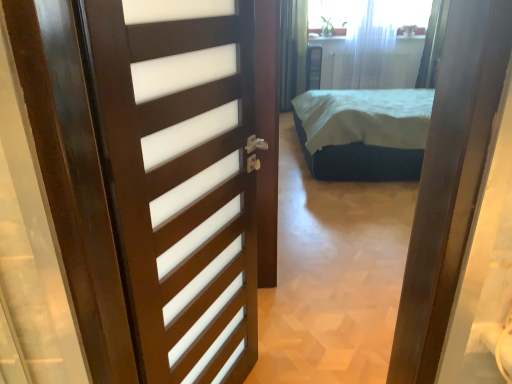
What do you see at coordinates (369, 48) in the screenshot? The width and height of the screenshot is (512, 384). I see `white sheer curtain at upper center` at bounding box center [369, 48].

Identify the location of dark wood door at left. This screenshot has height=384, width=512. (183, 176).

Is dark green fabric bed at center outside of dark wood door at left?

dark green fabric bed at center lies outside dark wood door at left's area.

Where is `bed located underneath the dark wood door at left (from a real-world perspective)`? bed located underneath the dark wood door at left (from a real-world perspective) is located at coordinates (364, 133).

Does dark green fabric bed at center come in front of dark wood door at left?

No, dark green fabric bed at center is further to the viewer.

Is dark green fabric bed at center touching dark wood door at left?

No, dark green fabric bed at center is not making contact with dark wood door at left.

From the image's perspective, between dark wood door at left and dark green fabric bed at center, which one is located above?

dark green fabric bed at center is shown above in the image.

How many degrees apart are the facing directions of dark wood door at left and dark green fabric bed at center?

153 degrees.

Based on the photo, is dark wood door at left in contact with dark green fabric bed at center?

No, dark wood door at left is not next to dark green fabric bed at center.

Looking at their sizes, would you say dark wood door at left is wider or thinner than dark green fabric bed at center?

Considering their sizes, dark wood door at left looks slimmer than dark green fabric bed at center.

The width and height of the screenshot is (512, 384). In order to click on curtain lying on the right of dark wood door at left in this screenshot , I will do `click(369, 48)`.

Consider the image. Is white sheer curtain at upper center located within dark wood door at left?

No, white sheer curtain at upper center is not a part of dark wood door at left.

From the picture: Which point is more distant from viewer, (112, 117) or (372, 49)?

The point (372, 49) is farther.

From the picture: Considering the sizes of objects dark wood door at left and white sheer curtain at upper center in the image provided, who is bigger, dark wood door at left or white sheer curtain at upper center?

white sheer curtain at upper center.

Which is closer to the camera, (352, 85) or (376, 160)?

Clearly, point (352, 85) is more distant from the camera than point (376, 160).

What's the angular difference between white sheer curtain at upper center and dark green fabric bed at center's facing directions?

white sheer curtain at upper center and dark green fabric bed at center are facing 89.7 degrees away from each other.

From the picture: Which of these two, white sheer curtain at upper center or dark green fabric bed at center, stands shorter?

dark green fabric bed at center is shorter.

From the image's perspective, which object appears higher, white sheer curtain at upper center or dark green fabric bed at center?

From the image's view, white sheer curtain at upper center is above.

Is white sheer curtain at upper center with dark wood door at left?

white sheer curtain at upper center and dark wood door at left are not in contact.

Is white sheer curtain at upper center looking in the opposite direction of dark wood door at left?

That's not correct — white sheer curtain at upper center is not looking away from dark wood door at left.

Where is `curtain located behind the dark wood door at left`? curtain located behind the dark wood door at left is located at coordinates (369, 48).

Is white sheer curtain at upper center not inside dark wood door at left?

white sheer curtain at upper center is positioned outside dark wood door at left.

Find the location of a particular element. curtain that appears on the right of dark green fabric bed at center is located at coordinates (369, 48).

Is dark green fabric bed at center bigger than white sheer curtain at upper center?

Yes.

Do you think dark green fabric bed at center is within white sheer curtain at upper center, or outside of it?

dark green fabric bed at center is not inside white sheer curtain at upper center, it's outside.

Which object is further away from the camera, dark green fabric bed at center or white sheer curtain at upper center?

Positioned behind is white sheer curtain at upper center.

What are the coordinates of `door on the left of dark green fabric bed at center` in the screenshot? It's located at (183, 176).

Locate an element on the screen. door in front of the dark green fabric bed at center is located at coordinates (183, 176).

When comparing their distances from dark green fabric bed at center, does dark wood door at left or white sheer curtain at upper center seem further?

Based on the image, dark wood door at left appears to be further to dark green fabric bed at center.

Based on their spatial positions, is white sheer curtain at upper center or dark wood door at left closer to dark green fabric bed at center?

The object closer to dark green fabric bed at center is white sheer curtain at upper center.

From the image, which object appears to be farther from dark wood door at left, dark green fabric bed at center or white sheer curtain at upper center?

white sheer curtain at upper center is positioned further to the anchor dark wood door at left.

Estimate the real-world distances between objects in this image. Which object is further from white sheer curtain at upper center, dark wood door at left or dark green fabric bed at center?

dark wood door at left is positioned further to the anchor white sheer curtain at upper center.

Considering their positions, is dark green fabric bed at center positioned further to white sheer curtain at upper center than dark wood door at left?

Based on the image, dark wood door at left appears to be further to white sheer curtain at upper center.

Estimate the real-world distances between objects in this image. Which object is further from dark wood door at left, white sheer curtain at upper center or dark green fabric bed at center?

The object further to dark wood door at left is white sheer curtain at upper center.

Identify the location of bed between dark wood door at left and white sheer curtain at upper center along the z-axis. The height and width of the screenshot is (384, 512). (x=364, y=133).